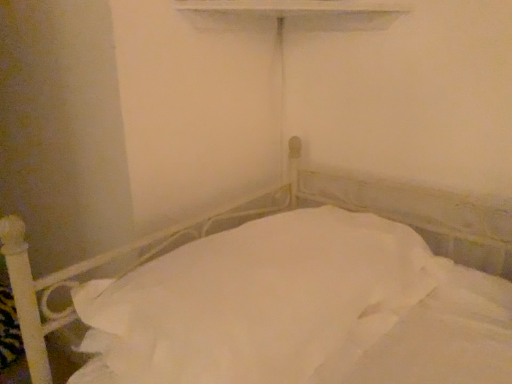
Question: Is white painted wood at upper center located outside white fabric bed at center?

Choices:
 (A) yes
 (B) no

Answer: (A)

Question: Does white painted wood at upper center have a lesser height compared to white fabric bed at center?

Choices:
 (A) no
 (B) yes

Answer: (B)

Question: Is the position of white painted wood at upper center more distant than that of white fabric bed at center?

Choices:
 (A) no
 (B) yes

Answer: (B)

Question: From the image's perspective, would you say white painted wood at upper center is shown under white fabric bed at center?

Choices:
 (A) yes
 (B) no

Answer: (B)

Question: Would you say white fabric bed at center is part of white painted wood at upper center's contents?

Choices:
 (A) no
 (B) yes

Answer: (A)

Question: From a real-world perspective, is white painted wood at upper center on white fabric bed at center?

Choices:
 (A) yes
 (B) no

Answer: (A)

Question: Is white fabric bed at center to the left of white painted wood at upper center from the viewer's perspective?

Choices:
 (A) yes
 (B) no

Answer: (A)

Question: Is white fabric bed at center positioned before white painted wood at upper center?

Choices:
 (A) no
 (B) yes

Answer: (B)

Question: Does white fabric bed at center have a larger size compared to white painted wood at upper center?

Choices:
 (A) no
 (B) yes

Answer: (B)

Question: Is white fabric bed at center looking in the opposite direction of white painted wood at upper center?

Choices:
 (A) yes
 (B) no

Answer: (B)

Question: Considering the relative sizes of white fabric bed at center and white painted wood at upper center in the image provided, is white fabric bed at center shorter than white painted wood at upper center?

Choices:
 (A) no
 (B) yes

Answer: (A)

Question: Is white fabric bed at center positioned behind white painted wood at upper center?

Choices:
 (A) yes
 (B) no

Answer: (B)

Question: Is point (217, 16) closer or farther from the camera than point (428, 223)?

Choices:
 (A) closer
 (B) farther

Answer: (A)